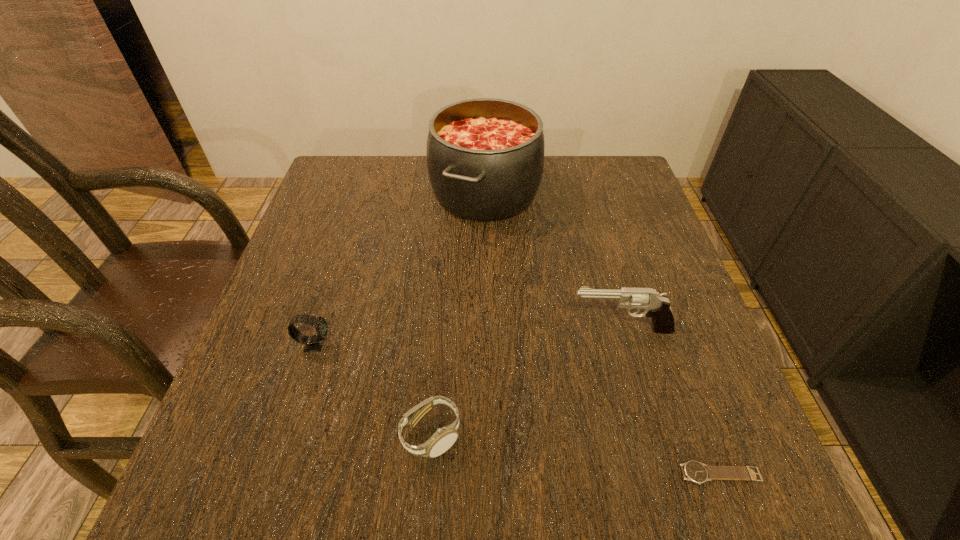
Image resolution: width=960 pixels, height=540 pixels. What are the coordinates of `free space located on the left of the tallest object` in the screenshot? It's located at (390, 193).

The image size is (960, 540). I want to click on vacant point located 0.330m at the muzzle of the fourth nearest object, so click(402, 329).

Image resolution: width=960 pixels, height=540 pixels. I want to click on vacant area located 0.240m at the muzzle of the fourth nearest object, so click(x=448, y=329).

Identify the location of vacant area located at the muzzle of the fourth nearest object. (427, 329).

You are a GUI agent. You are given a task and a screenshot of the screen. Output one action in this format:
    pyautogui.click(x=<x>, y=<y>)
    Task: Click on the free region located 0.260m on the face of the third shortest object
    
    Given the screenshot: What is the action you would take?
    pyautogui.click(x=468, y=345)

At what (x,y) coordinates should I click in order to perform the action: click on vacant space located on the face of the second watch from left to right. Please return your answer as a coordinate pair (x, y). Looking at the image, I should click on (675, 435).

Where is `vacant position located on the back of the shortest object`? This screenshot has height=540, width=960. vacant position located on the back of the shortest object is located at coordinates (688, 388).

Locate an element on the screen. object positioned at the far edge is located at coordinates (485, 157).

The width and height of the screenshot is (960, 540). What are the coordinates of `object located in the left edge section of the desktop` in the screenshot? It's located at (313, 343).

I want to click on gun that is at the right edge, so click(655, 305).